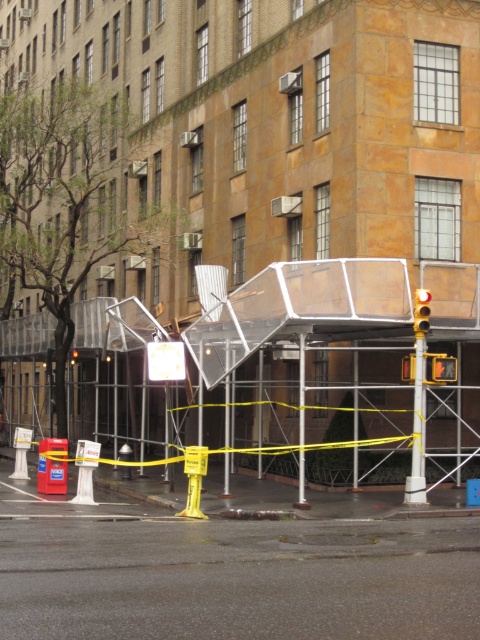
Between metallic yellow pole at right and yellow plastic traffic light at center, which one has more height?

With more height is metallic yellow pole at right.

Can you confirm if metallic yellow pole at right is positioned to the left of yellow plastic traffic light at center?

Indeed, metallic yellow pole at right is positioned on the left side of yellow plastic traffic light at center.

Where is `metallic yellow pole at right`? metallic yellow pole at right is located at coordinates (418, 429).

This screenshot has width=480, height=640. I want to click on metallic yellow pole at right, so click(418, 429).